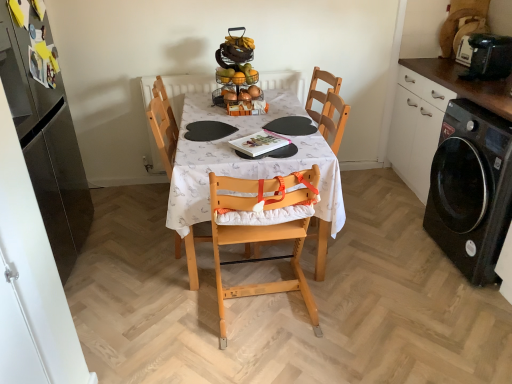
Identify the location of vacant space in front of light wood highchair at center, the first chair viewed from the right. The width and height of the screenshot is (512, 384). (271, 355).